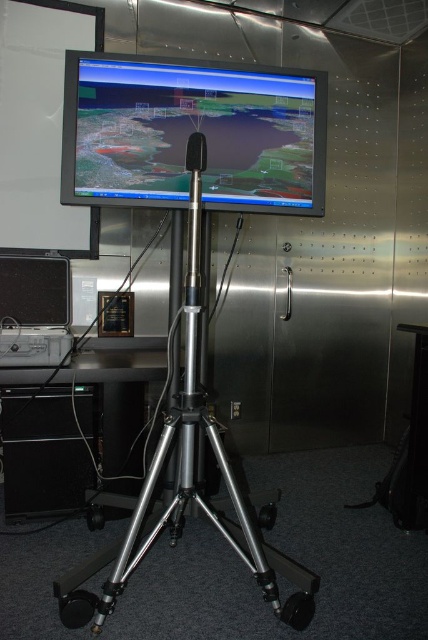
From the picture: Which of these two, silver metallic tripod at center or black plastic speaker at lower left, stands taller?

With more height is silver metallic tripod at center.

Can you confirm if silver metallic tripod at center is positioned below black plastic speaker at lower left?

Indeed, silver metallic tripod at center is positioned under black plastic speaker at lower left.

Looking at this image, who is more forward, (192, 324) or (2, 266)?

Positioned in front is point (192, 324).

The width and height of the screenshot is (428, 640). In order to click on silver metallic tripod at center in this screenshot , I will do `click(189, 436)`.

Can you confirm if black plastic computer desk at lower left is thinner than silver metallic tripod at center?

No.

Is point (77, 438) less distant than point (175, 525)?

No, it is not.

The image size is (428, 640). Identify the location of black plastic computer desk at lower left. (74, 429).

Looking at this image, between matte black monitor at center and black plastic computer desk at lower left, which one has more height?

black plastic computer desk at lower left is taller.

Can you confirm if matte black monitor at center is taller than black plastic computer desk at lower left?

No, matte black monitor at center is not taller than black plastic computer desk at lower left.

At what (x,y) coordinates should I click in order to perform the action: click on matte black monitor at center. Please return your answer as a coordinate pair (x, y). Looking at the image, I should click on (192, 132).

Identify the location of matte black monitor at center. (192, 132).